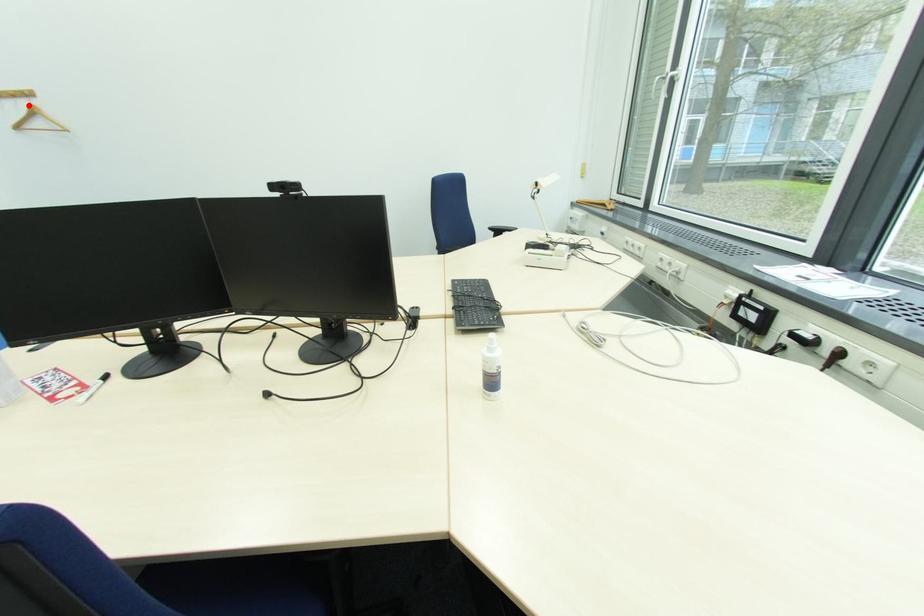
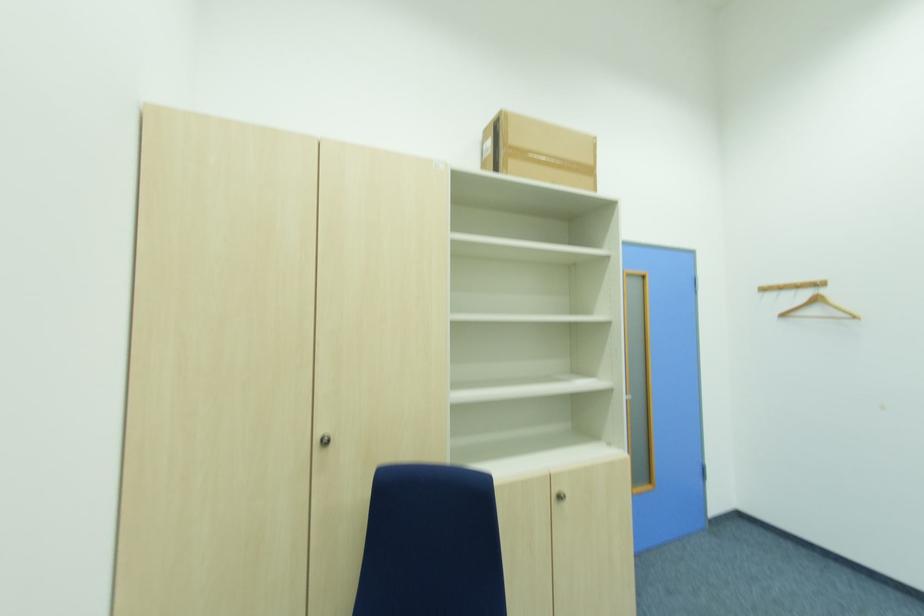
Find the pixel in the second image that matches the highlighted location in the first image.

(809, 296)